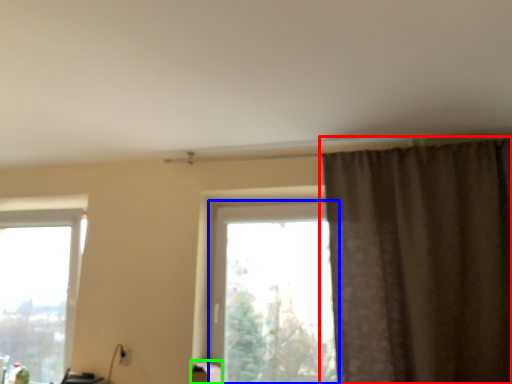
Question: Which object is positioned closest to curtain (highlighted by a red box)? Select from window (highlighted by a blue box) and furniture (highlighted by a green box).

Choices:
 (A) window
 (B) furniture

Answer: (A)